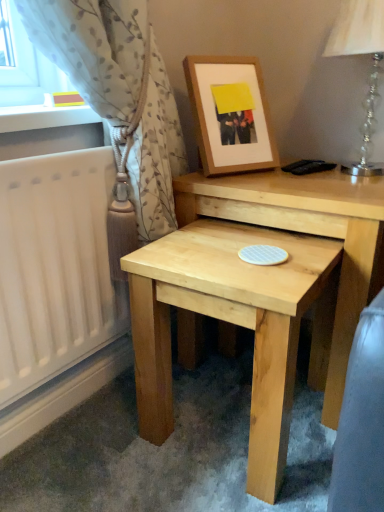
The height and width of the screenshot is (512, 384). In order to click on vacant space situated above natural wood table at center, the first table from the back (from a real-world perspective) in this screenshot , I will do `click(297, 177)`.